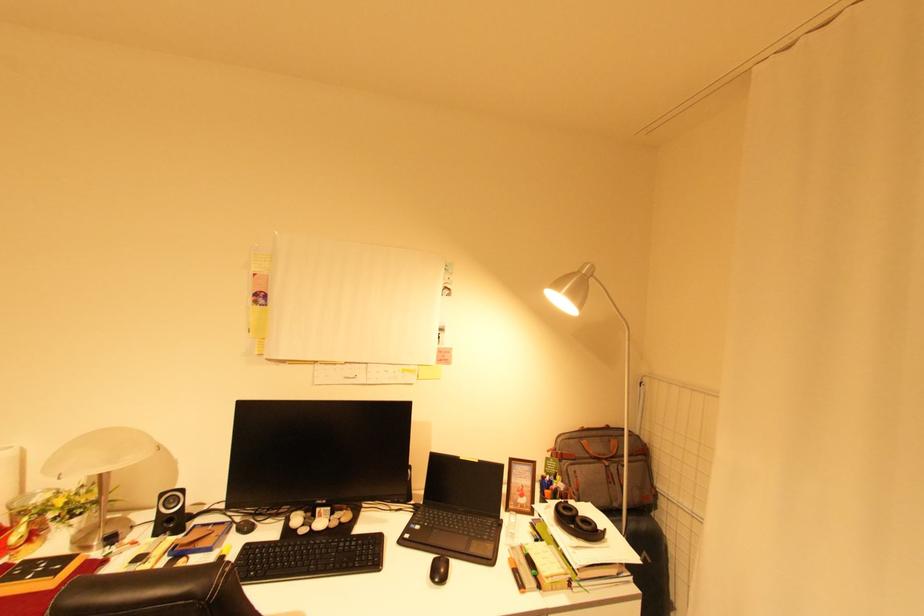
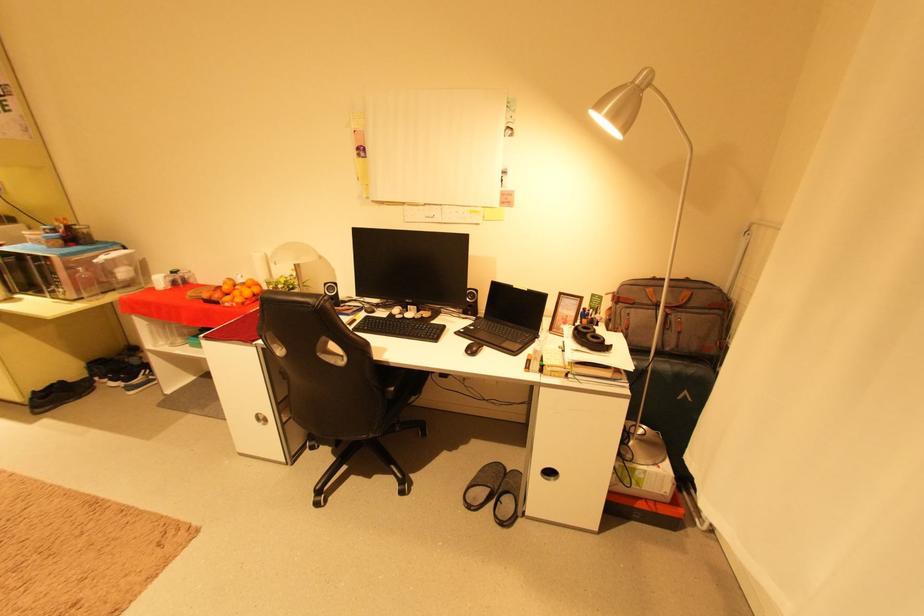
Where in the second image is the point corresponding to point 484,462 from the first image?

(533, 291)